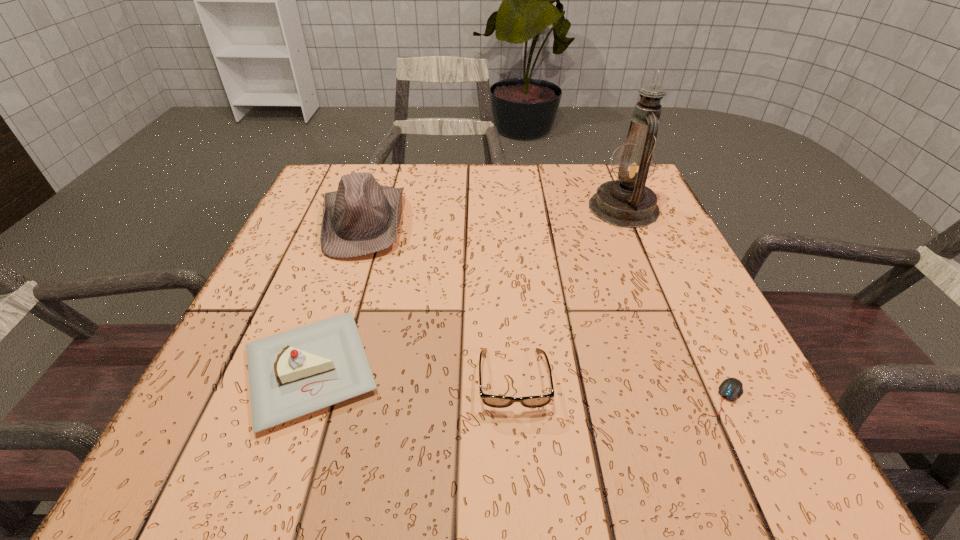
Where is `blank space located 0.130m on the back of the shortest object`? This screenshot has height=540, width=960. blank space located 0.130m on the back of the shortest object is located at coordinates (683, 320).

The image size is (960, 540). I want to click on oil lamp that is at the far edge, so click(x=627, y=202).

At what (x,y) coordinates should I click in order to perform the action: click on fedora at the far edge. Please return your answer as a coordinate pair (x, y). The image size is (960, 540). Looking at the image, I should click on (361, 217).

You are a GUI agent. You are given a task and a screenshot of the screen. Output one action in this format:
    pyautogui.click(x=<x>, y=<y>)
    Task: Click on the cake that is positioned at the near edge
    The height and width of the screenshot is (540, 960).
    Given the screenshot: What is the action you would take?
    pyautogui.click(x=291, y=374)

Locate an element on the screen. Image resolution: width=960 pixels, height=540 pixels. mouse present at the near edge is located at coordinates (731, 388).

The height and width of the screenshot is (540, 960). In order to click on fedora located at the left edge in this screenshot , I will do `click(361, 217)`.

Find the location of `cake that is at the left edge`. cake that is at the left edge is located at coordinates pos(291,374).

This screenshot has height=540, width=960. Identify the location of oil lamp that is at the right edge. (627, 202).

This screenshot has width=960, height=540. I want to click on mouse situated at the right edge, so click(731, 388).

Image resolution: width=960 pixels, height=540 pixels. In order to click on object that is at the far left corner in this screenshot , I will do `click(361, 217)`.